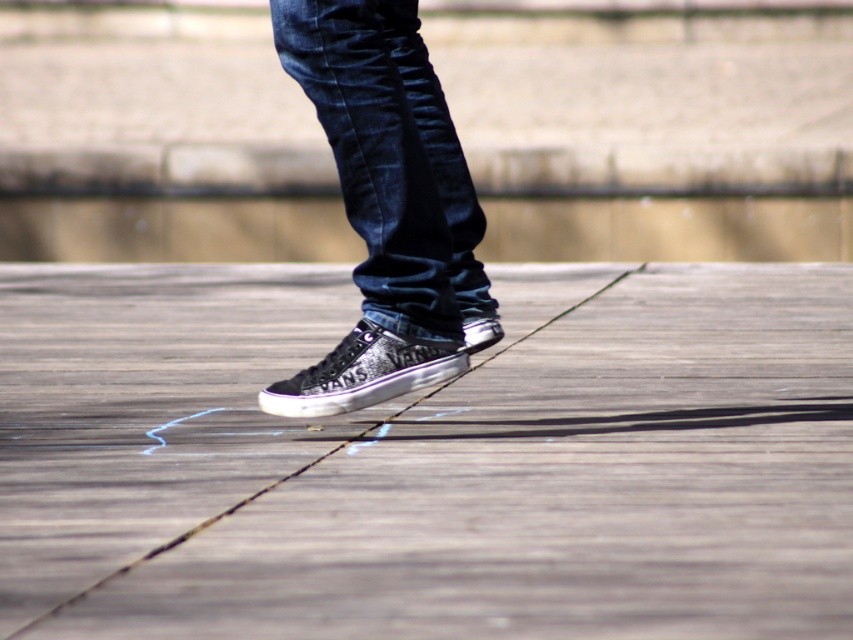
Which is behind, point (788, 525) or point (415, 216)?

The point (415, 216) is behind.

Is wooden at center thinner than denim at center?

No, wooden at center is not thinner than denim at center.

I want to click on wooden at center, so click(x=427, y=458).

Can you confirm if denim at center is bigger than glittery black sneakers at center?

Yes, denim at center is bigger than glittery black sneakers at center.

Who is more forward, (370, 273) or (440, 376)?

Point (370, 273)

This screenshot has width=853, height=640. Find the location of `denim at center`. denim at center is located at coordinates (390, 157).

Is wooden at center above shiny black sneaker at center?

No, wooden at center is not above shiny black sneaker at center.

Between wooden at center and shiny black sneaker at center, which one has less height?

shiny black sneaker at center

The width and height of the screenshot is (853, 640). Identify the location of wooden at center. (427, 458).

Find the location of a particular element. This screenshot has height=640, width=853. wooden at center is located at coordinates (427, 458).